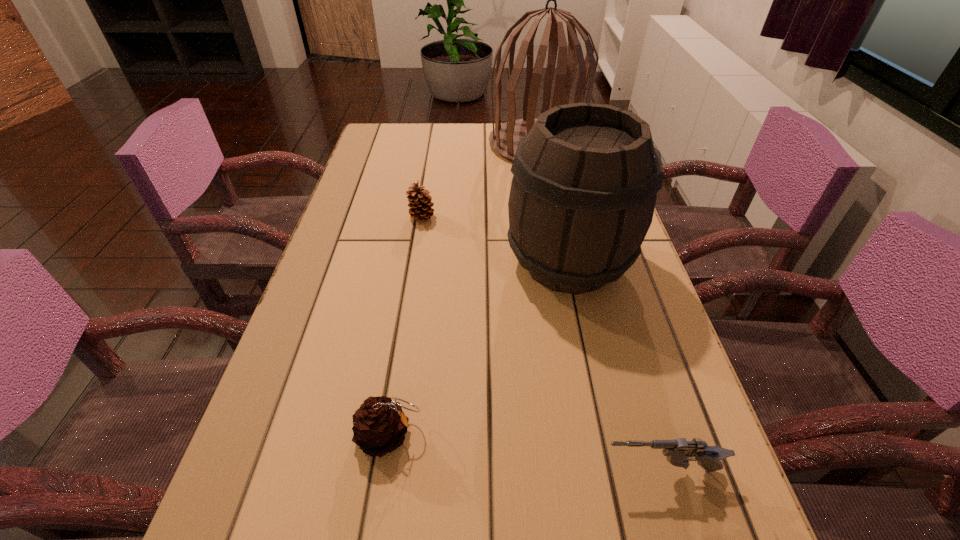
Find the location of a particular element. birdcage is located at coordinates (504, 139).

This screenshot has width=960, height=540. I want to click on the farthest object, so pos(504,139).

In order to click on the fourth shortest object in this screenshot , I will do `click(582, 198)`.

Where is `the farther pinecone`? The width and height of the screenshot is (960, 540). the farther pinecone is located at coordinates (420, 204).

Where is `the nearer pinecone`? This screenshot has width=960, height=540. the nearer pinecone is located at coordinates (380, 425).

I want to click on gun, so click(x=679, y=452).

Where is `vacant space situated 0.200m on the front of the birdcage`? The image size is (960, 540). vacant space situated 0.200m on the front of the birdcage is located at coordinates (548, 208).

You are a GUI agent. You are given a task and a screenshot of the screen. Output one action in this format:
    pyautogui.click(x=<x>, y=<y>)
    Task: Click on the vacant space located on the front of the wine bucket
    Image resolution: width=960 pixels, height=540 pixels.
    Given the screenshot: What is the action you would take?
    pyautogui.click(x=619, y=499)

This screenshot has width=960, height=540. In order to click on vacant space located on the front of the farther pinecone in this screenshot , I will do `click(413, 277)`.

This screenshot has height=540, width=960. I want to click on free space located with a leaf charm attached to the second nearest object, so tap(619, 435).